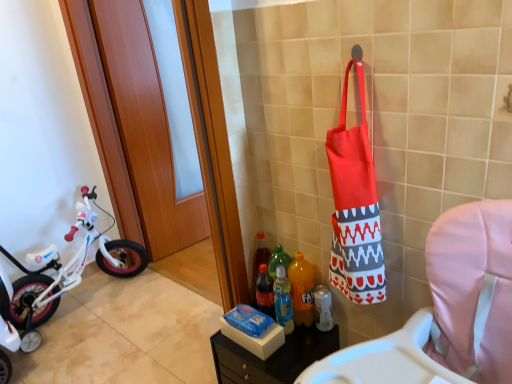
Image resolution: width=512 pixels, height=384 pixels. What are the coordinates of `free space to the left of white plastic can at lower center, which is the first bottle from right to left` in the screenshot? It's located at (297, 344).